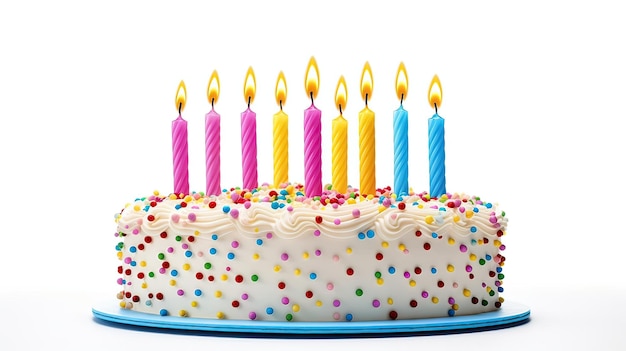
Identify the location of candle flames. The image size is (626, 351). (183, 102), (215, 86), (249, 90), (280, 94), (312, 81), (340, 96), (367, 84), (403, 86), (438, 102).